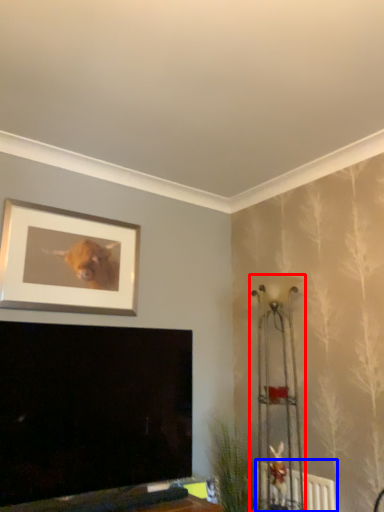
Question: Among these objects, which one is nearest to the camera, lamp (highlighted by a red box) or radiator (highlighted by a blue box)?

Choices:
 (A) lamp
 (B) radiator

Answer: (A)